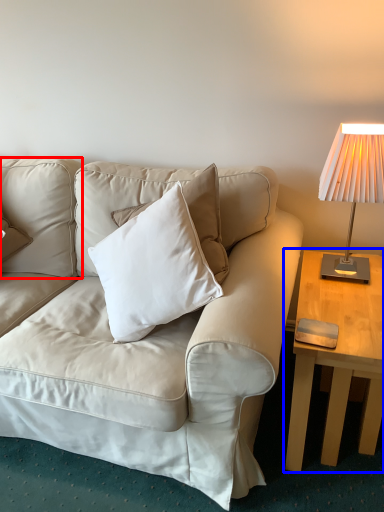
Question: Which object is further to the camera taking this photo, pillow (highlighted by a red box) or table (highlighted by a blue box)?

Choices:
 (A) pillow
 (B) table

Answer: (A)